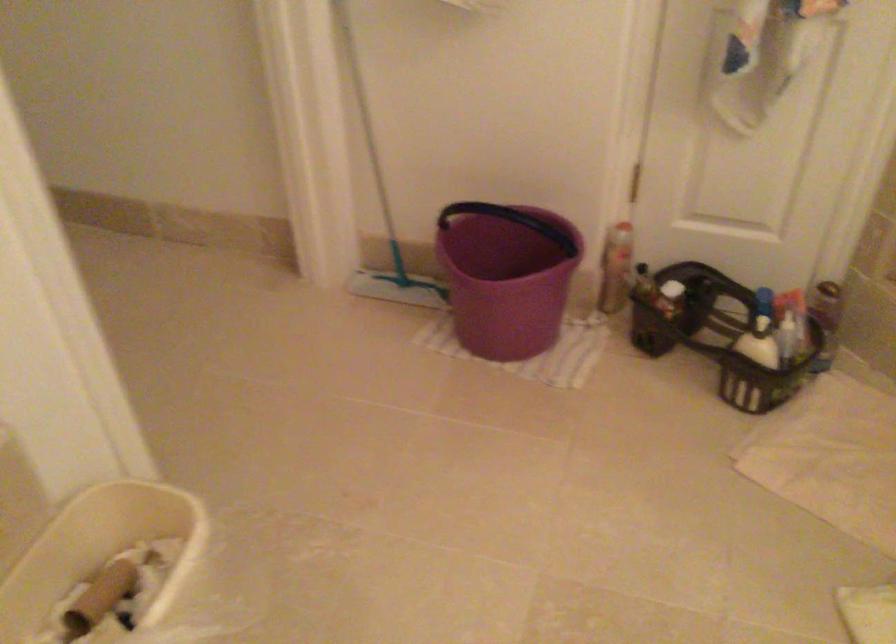
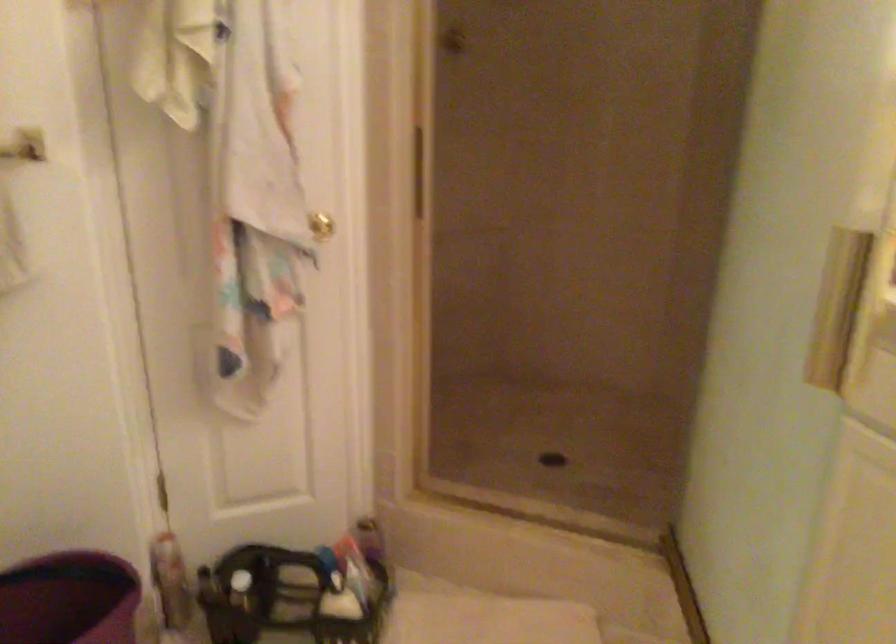
Locate, in the second image, the point that corresponds to (530,249) in the first image.

(69, 599)